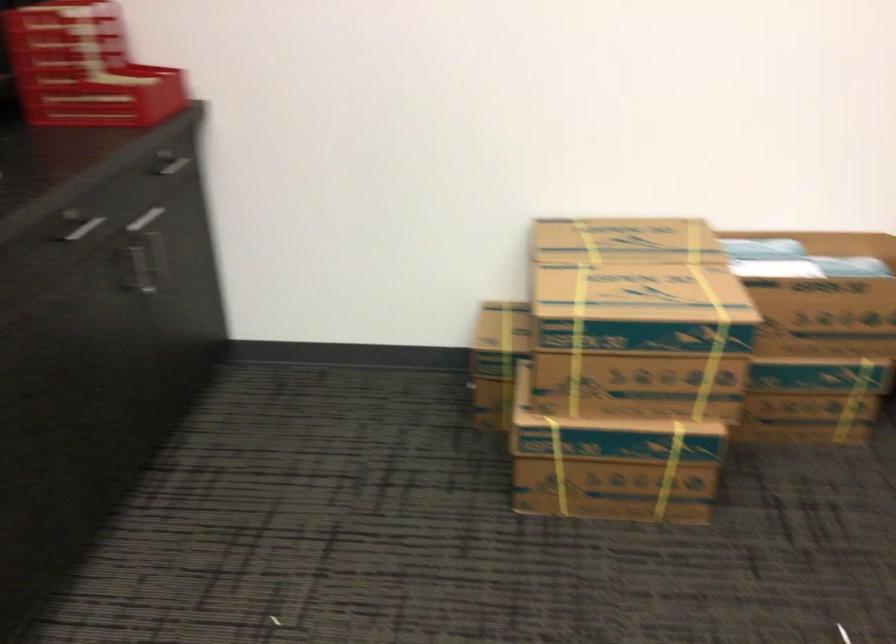
The width and height of the screenshot is (896, 644). What do you see at coordinates (147, 234) in the screenshot?
I see `a silver cabinet handle` at bounding box center [147, 234].